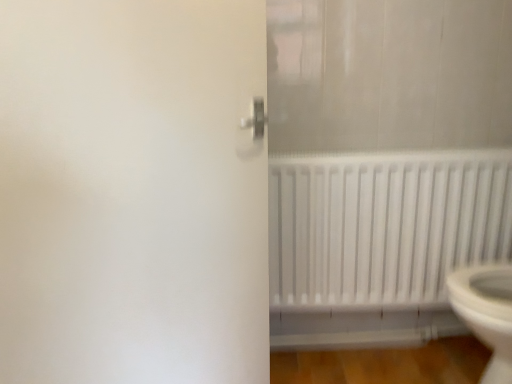
At what (x,y) coordinates should I click in order to perform the action: click on white matte door at left. Please return your answer as a coordinate pair (x, y). Looking at the image, I should click on (132, 193).

Describe the element at coordinates (132, 193) in the screenshot. I see `white matte door at left` at that location.

This screenshot has height=384, width=512. Describe the element at coordinates (383, 225) in the screenshot. I see `white matte radiator at lower right` at that location.

This screenshot has height=384, width=512. I want to click on white matte radiator at lower right, so click(383, 225).

You are a GUI agent. You are given a task and a screenshot of the screen. Output one action in this format:
    pyautogui.click(x=<x>, y=<y>)
    Task: Click on the white matte door at left
    The height and width of the screenshot is (384, 512).
    Given the screenshot: What is the action you would take?
    pyautogui.click(x=132, y=193)

Between white matte radiator at lower right and white matte door at left, which one appears on the right side from the viewer's perspective?

white matte radiator at lower right.

Is white matte radiator at lower right in front of or behind white matte door at left in the image?

white matte radiator at lower right is positioned farther from the viewer than white matte door at left.

Does point (280, 291) come behind point (188, 50)?

Yes, it is behind point (188, 50).

From the image's perspective, does white matte radiator at lower right appear lower than white matte door at left?

Yes, from the image's perspective, white matte radiator at lower right is below white matte door at left.

From a real-world perspective, does white matte radiator at lower right stand above white matte door at left?

Actually, white matte radiator at lower right is physically below white matte door at left in the real world.

Which object is wider, white matte radiator at lower right or white matte door at left?

white matte radiator at lower right.

Who is taller, white matte radiator at lower right or white matte door at left?

With more height is white matte door at left.

Considering the sizes of white matte radiator at lower right and white matte door at left in the image, is white matte radiator at lower right bigger or smaller than white matte door at left?

In the image, white matte radiator at lower right appears to be smaller than white matte door at left.

Is white matte radiator at lower right inside or outside of white matte door at left?

white matte radiator at lower right is not inside white matte door at left, it's outside.

Is white matte radiator at lower right next to white matte door at left?

They are not placed beside each other.

Is white matte radiator at lower right facing towards white matte door at left?

No, white matte radiator at lower right is not oriented towards white matte door at left.

What's the angular difference between white matte radiator at lower right and white matte door at left's facing directions?

44.3 degrees.

Locate an element on the screen. The height and width of the screenshot is (384, 512). radiator that appears below the white matte door at left (from a real-world perspective) is located at coordinates (383, 225).

Does white matte door at left appear on the left side of white matte radiator at lower right?

Yes.

Which object is more forward, white matte door at left or white matte radiator at lower right?

white matte door at left is closer to the camera.

Which is in front, point (165, 30) or point (351, 267)?

Point (165, 30)

From the image's perspective, is white matte door at left beneath white matte radiator at lower right?

Actually, white matte door at left appears above white matte radiator at lower right in the image.

From a real-world perspective, which is physically below, white matte door at left or white matte radiator at lower right?

In real-world perspective, white matte radiator at lower right is lower.

Looking at their sizes, would you say white matte door at left is wider or thinner than white matte radiator at lower right?

white matte door at left is thinner than white matte radiator at lower right.

Between white matte door at left and white matte radiator at lower right, which one has more height?

white matte door at left is taller.

Who is bigger, white matte door at left or white matte radiator at lower right?

white matte door at left is bigger.

Is white matte door at left positioned beyond the bounds of white matte radiator at lower right?

white matte door at left lies outside white matte radiator at lower right's area.

Is white matte door at left not close to white matte radiator at lower right?

white matte door at left is actually quite close to white matte radiator at lower right.

Is white matte door at left looking in the opposite direction of white matte radiator at lower right?

No, white matte door at left is not facing away from white matte radiator at lower right.

How different are the orientations of white matte door at left and white matte radiator at lower right in degrees?

The angle between the facing direction of white matte door at left and the facing direction of white matte radiator at lower right is 44.3 degrees.

At what (x,y) coordinates should I click in order to perform the action: click on radiator that appears on the right of white matte door at left. Please return your answer as a coordinate pair (x, y). This screenshot has width=512, height=384. Looking at the image, I should click on (383, 225).

Find the location of a particular element. This screenshot has width=512, height=384. screen door on the left of white matte radiator at lower right is located at coordinates (132, 193).

Where is `screen door that appears above the white matte radiator at lower right (from a real-world perspective)`? The image size is (512, 384). screen door that appears above the white matte radiator at lower right (from a real-world perspective) is located at coordinates (132, 193).